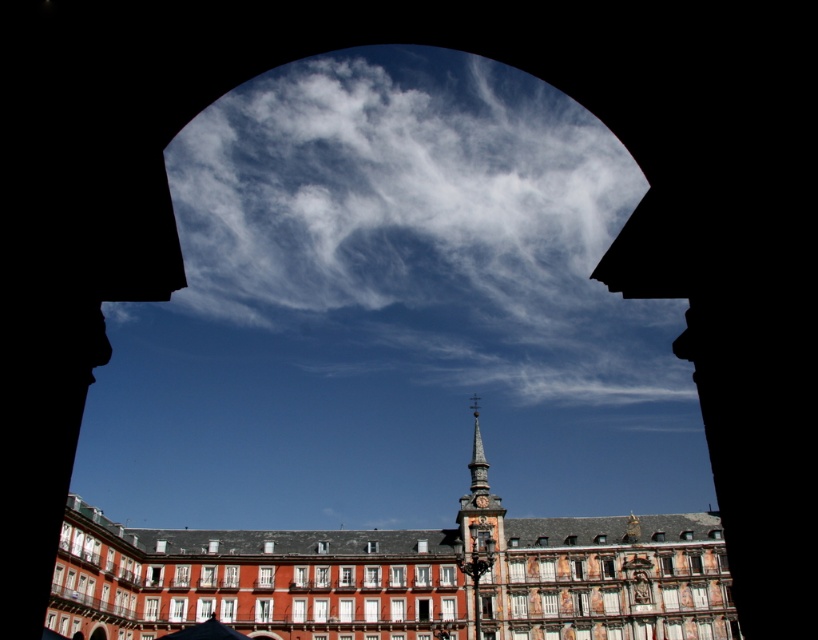
Question: Which point is farther to the camera?

Choices:
 (A) white fluffy cloud at upper center
 (B) polished stone clock tower at center

Answer: (A)

Question: In this image, where is white fluffy cloud at upper center located relative to smooth gray spire at center?

Choices:
 (A) right
 (B) left

Answer: (B)

Question: Can you confirm if dark blue fabric umbrella at lower center is bigger than smooth gray spire at center?

Choices:
 (A) no
 (B) yes

Answer: (A)

Question: Considering the relative positions of smooth red brick building at center and polished stone clock tower at center in the image provided, where is smooth red brick building at center located with respect to polished stone clock tower at center?

Choices:
 (A) below
 (B) above

Answer: (A)

Question: Which of the following is the closest to the observer?

Choices:
 (A) (218, 620)
 (B) (455, 579)

Answer: (A)

Question: Which object appears farthest from the camera in this image?

Choices:
 (A) polished stone clock tower at center
 (B) dark blue fabric umbrella at lower center
 (C) white fluffy cloud at upper center

Answer: (C)